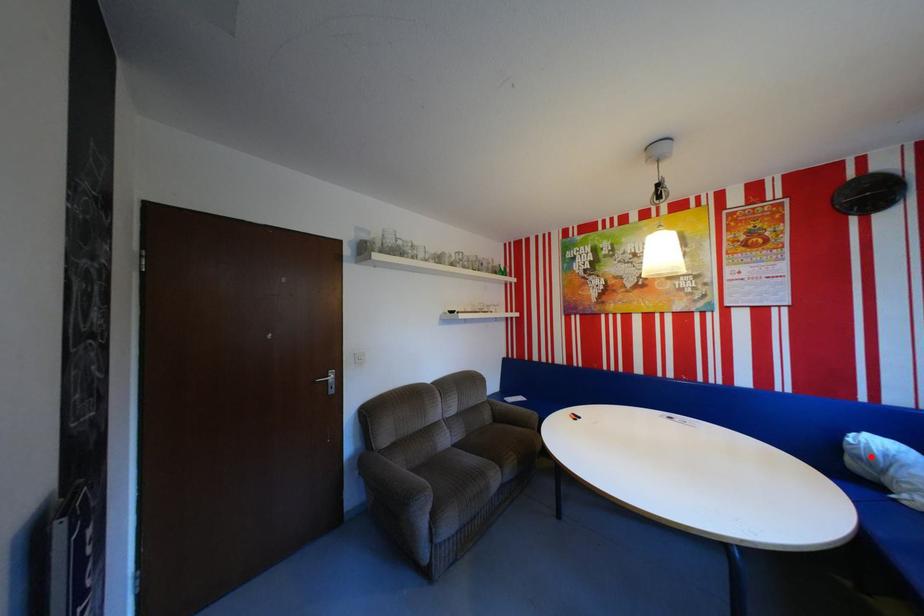
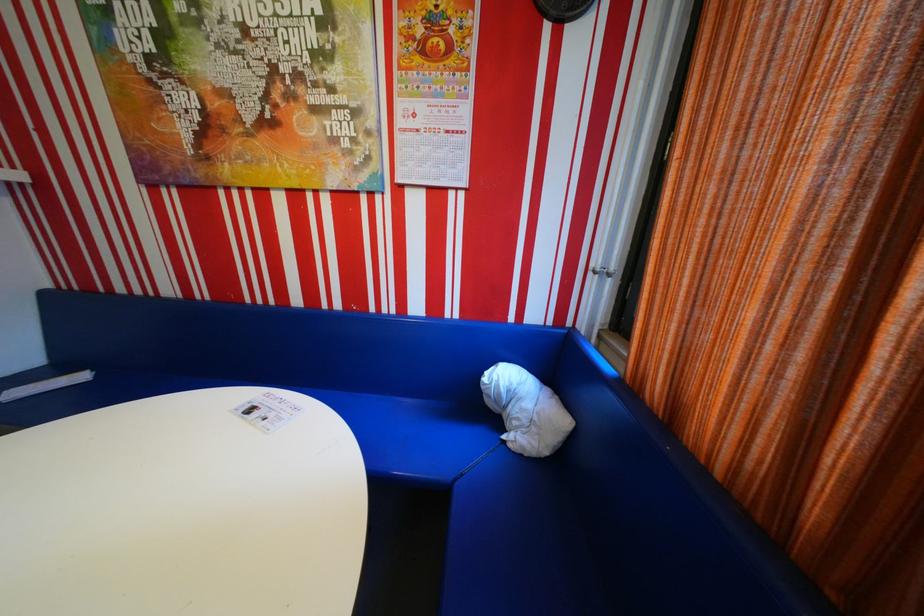
Find the pixel in the second image that matches the highlighted location in the first image.

(502, 395)